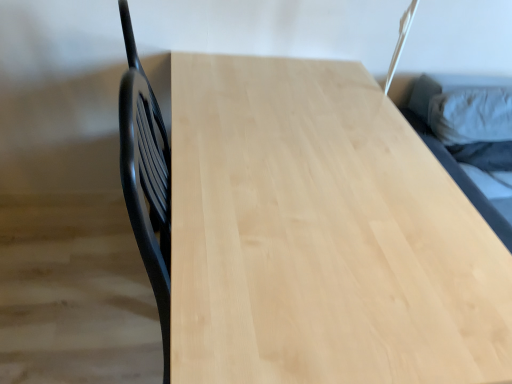
In order to face light wood table at center, should I rotate leftwards or rightwards?

You should look right and rotate roughly 4.831 degrees.

This screenshot has width=512, height=384. What do you see at coordinates (322, 235) in the screenshot?
I see `light wood table at center` at bounding box center [322, 235].

Where is `light wood table at center`? The width and height of the screenshot is (512, 384). light wood table at center is located at coordinates (322, 235).

The width and height of the screenshot is (512, 384). What are the coordinates of `light wood table at center` in the screenshot? It's located at (322, 235).